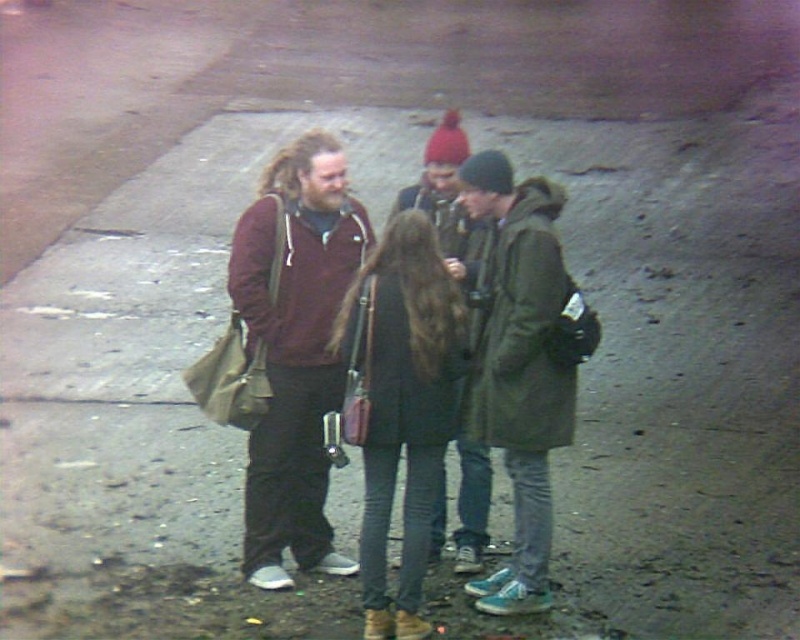
You are a photographer trying to capture a group photo of the two people wearing dark green jackets. The camera you have can only focus on objects within a 1.5 meter width. Given that the dark green leather jacket at center is wider than the dark green textured coat at center, will both jackets fit within the camera frame?

The dark green leather jacket at center is wider than the dark green textured coat at center. Since the camera can only focus on objects within a 1.5 meter width, the total width of both jackets combined may exceed the camera frame. However, if the photographer positions the camera to focus on the wider jacket first, the narrower coat might still fit within the frame depending on their exact positioning. Without specific measurements, it is uncertain if both will fit perfectly.

You are standing at the point labeled as point (x=376, y=356) and want to walk towards the point labeled as point (x=346, y=253). Which direction should you face to move directly towards it?

You should face north to move directly towards point (x=346, y=253) from point (x=376, y=356) since it is behind the latter point.

You are standing at point (456, 120) and want to walk to the location where Person 2 is holding a phone. Which direction should you move relative to point (360, 298)?

You should move towards point (360, 298) because it is in front of point (456, 120), so moving towards it would lead you closer to Person 2 holding the phone.